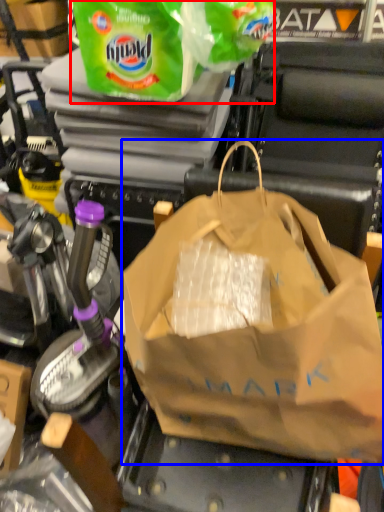
Question: Which of the following is the closest to the observer, plastic bag (highlighted by a red box) or plastic bag (highlighted by a blue box)?

Choices:
 (A) plastic bag
 (B) plastic bag

Answer: (B)